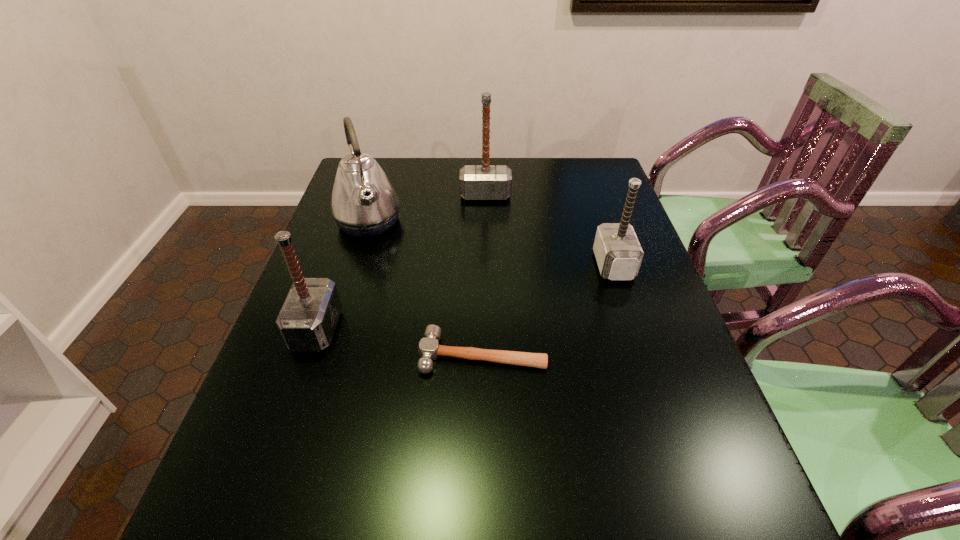
Where is `unoccupied area between the kettle and the leftmost hammer`? The height and width of the screenshot is (540, 960). unoccupied area between the kettle and the leftmost hammer is located at coordinates (343, 276).

Choose which object is the second nearest neighbor to the leftmost hammer. Please provide its 2D coordinates. Your answer should be formatted as a tuple, i.e. [(x, y)], where the tuple contains the x and y coordinates of a point satisfying the conditions above.

[(364, 203)]

Identify which object is the second closest to the kettle. Please provide its 2D coordinates. Your answer should be formatted as a tuple, i.e. [(x, y)], where the tuple contains the x and y coordinates of a point satisfying the conditions above.

[(307, 321)]

Select which hammer is the third closest to the leftmost hammer. Please provide its 2D coordinates. Your answer should be formatted as a tuple, i.e. [(x, y)], where the tuple contains the x and y coordinates of a point satisfying the conditions above.

[(618, 253)]

Locate an element on the screen. the third closest hammer to the rightmost object is located at coordinates (307, 321).

The image size is (960, 540). What are the coordinates of `free spot that satisfies the following two spatial constraints: 1. for striking with the head of the third nearest hammer; 2. on the front side of the leftmost hammer` in the screenshot? It's located at (635, 329).